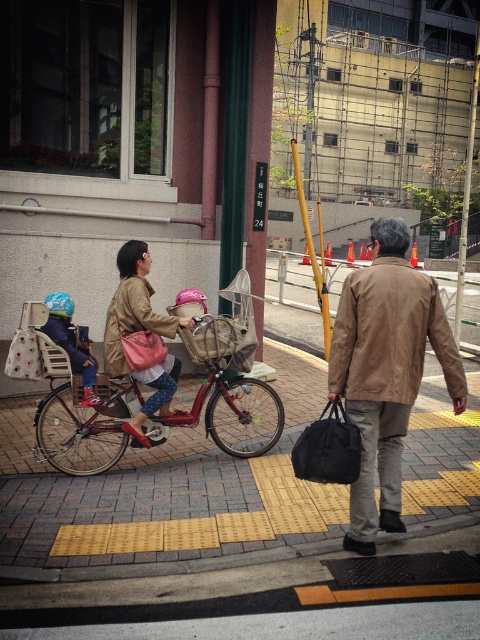
You are standing on the sidewalk and see the metallic red bicycle at center. If you want to reach it in 2 seconds, what is the minimum speed you need to move towards it?

The metallic red bicycle at center is 4.62 meters away. To reach it in 2 seconds, you need to move at a minimum speed of 2.31 meters per second.